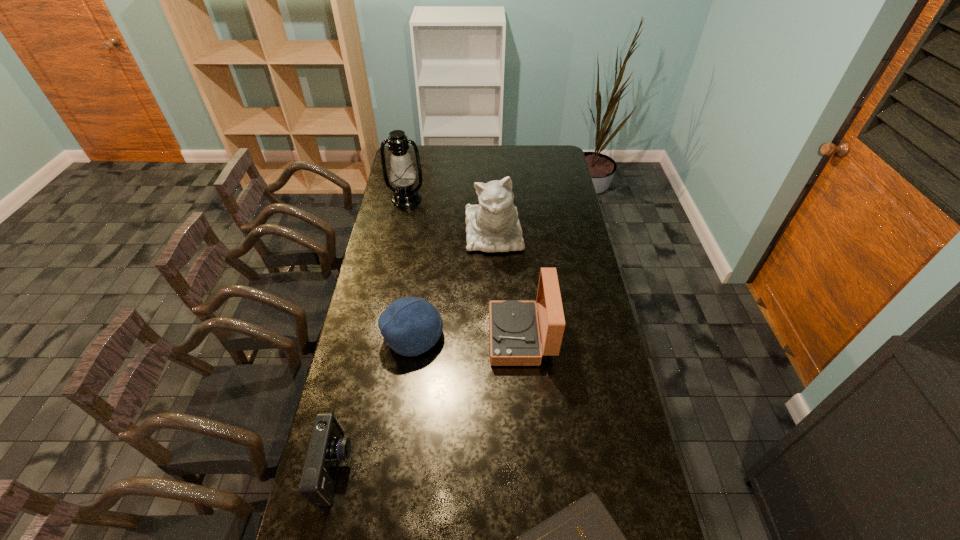
Find the location of a particular element. This screenshot has height=540, width=960. vacant space located 0.110m on the back of the skullcap is located at coordinates [420, 291].

At what (x,y) coordinates should I click in order to perform the action: click on vacant region located 0.260m on the front-facing side of the fifth tallest object. Please return your answer as a coordinate pair (x, y). This screenshot has height=540, width=960. Looking at the image, I should click on (442, 469).

Find the location of a particular element. The image size is (960, 540). oil lamp that is at the left edge is located at coordinates (402, 174).

Where is `skullcap positioned at the left edge`? This screenshot has width=960, height=540. skullcap positioned at the left edge is located at coordinates (410, 326).

At what (x,y) coordinates should I click in order to perform the action: click on camera that is at the left edge. Please return your answer as a coordinate pair (x, y). Image resolution: width=960 pixels, height=540 pixels. Looking at the image, I should click on (327, 447).

This screenshot has height=540, width=960. I want to click on free space at the far edge of the desktop, so click(x=484, y=145).

In the image, there is a desktop. At what (x,y) coordinates should I click in order to perform the action: click on vacant space at the left edge. Please return your answer as a coordinate pair (x, y). This screenshot has height=540, width=960. Looking at the image, I should click on (393, 228).

Find the location of a particular element. The image size is (960, 540). blank space at the right edge of the desktop is located at coordinates (567, 266).

Locate an element on the screen. The height and width of the screenshot is (540, 960). free space between the farthest object and the skullcap is located at coordinates (410, 267).

Where is `vacant point located between the oil lamp and the cat`? This screenshot has width=960, height=540. vacant point located between the oil lamp and the cat is located at coordinates (450, 216).